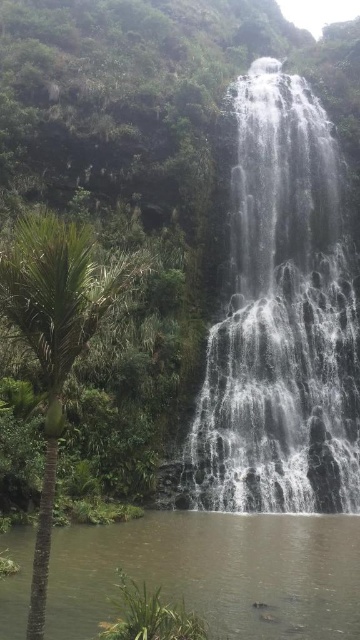
You are standing at the base of the waterfall and want to cross from one side to the other using the brown smooth water at bottom. However, there is a narrow path next to the translucent glass waterfall at center. Considering their widths, which part would allow you to pass through more comfortably?

The brown smooth water at bottom has a greater width than the translucent glass waterfall at center, so you can pass through more comfortably on the brown smooth water at bottom.

You are a photographer planning to capture the waterfall and its surroundings. You want to highlight both the translucent glass waterfall at center and the brown smooth water at bottom in your shot. Which object should you focus on first if you want to emphasize the larger one?

The translucent glass waterfall at center has a larger size compared to brown smooth water at bottom, so you should focus on the translucent glass waterfall at center first to emphasize its size.

You are standing at the edge of the waterfall and want to place a small stepping stone between the brown smooth water at bottom and the green leafy palm tree at left. If the stepping stone is 3 feet wide, will there be enough space between them to place it?

The brown smooth water at bottom is 9.17 feet away from the green leafy palm tree at left. Since the stepping stone is 3 feet wide, there is sufficient space to place it between them as the distance is greater than the stone width.